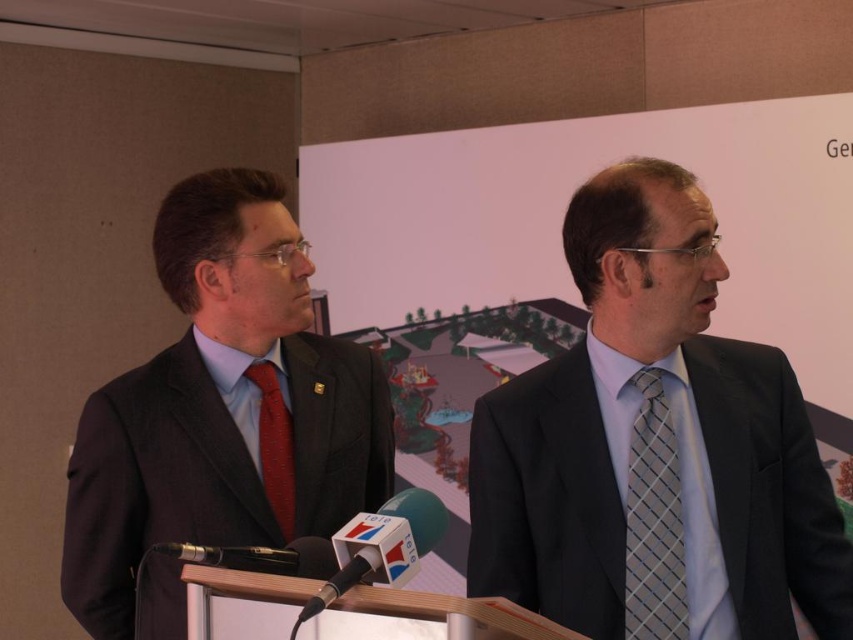
You are a photographer setting up for a group photo. The two men are standing behind the podium with their ties visible. You need to ensure there is enough space between the light blue silk tie at right and the gray checkered tie at center for proper framing. The minimum required space between subjects for your camera setup is 5 inches. Based on the scene description, will the current spacing between the ties allow for proper framing?

The distance between the light blue silk tie at right and the gray checkered tie at center is 4.80 inches, which is less than the required 5 inches. Therefore, the current spacing does not allow for proper framing, and adjustments are needed to increase the distance between them.

You are a photographer at the back of the room during a press conference. You want to take a photo of both the point at coordinates point (x=131, y=572) and point (x=633, y=433) in the image. However, you notice that one of them is blocking the other. Which point is being blocked and why?

Point (x=131, y=572) is behind point (x=633, y=433), so the photographer cannot see it because it is obscured by the other point.

You are organizing a formal event and need to ensure that all participants have ties that meet specific height requirements. You have two ties available for selection. The light blue silk tie at right and the red silk tie at center. Which tie should you choose if you need a taller one?

The light blue silk tie at right is much taller than the red silk tie at center, so you should choose the light blue silk tie at right.